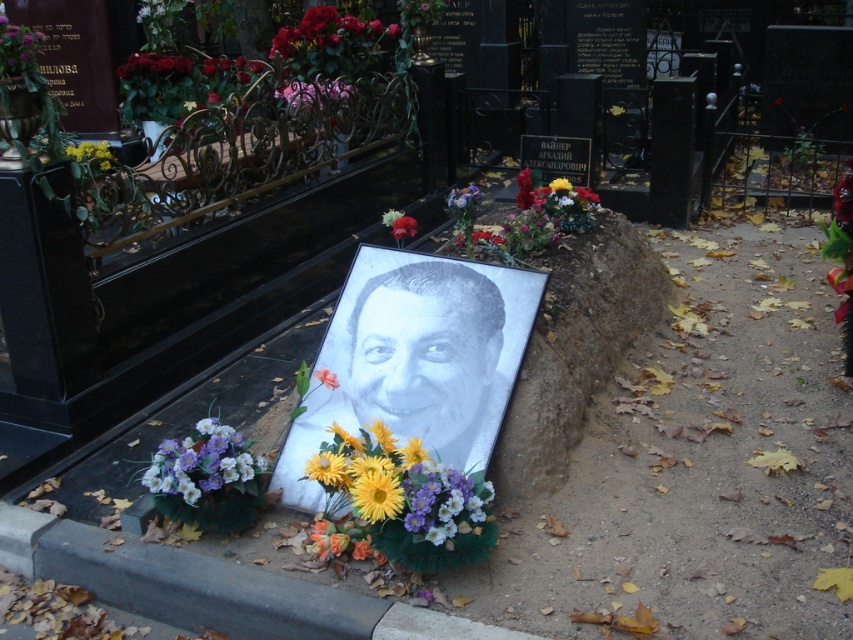
Which is behind, point (519, 237) or point (320, 36)?

The point (320, 36) is more distant.

Describe the element at coordinates (535, 216) in the screenshot. I see `multicolored fabric bouquet at center` at that location.

Image resolution: width=853 pixels, height=640 pixels. In order to click on multicolored fabric bouquet at center in this screenshot , I will do `click(535, 216)`.

Can you confirm if metallic purple flowers at upper center is shorter than yellow matte flower at upper left?

Yes, metallic purple flowers at upper center is shorter than yellow matte flower at upper left.

Which is behind, point (291, 88) or point (100, 144)?

The point (100, 144) is behind.

Where is `metallic purple flowers at upper center`? The height and width of the screenshot is (640, 853). metallic purple flowers at upper center is located at coordinates (312, 92).

Is yellow paper flower at center below metallic purple flowers at upper center?

Correct, yellow paper flower at center is located below metallic purple flowers at upper center.

Which is in front, point (399, 502) or point (288, 97)?

Point (399, 502) is more forward.

Identify the location of yellow paper flower at center. (376, 493).